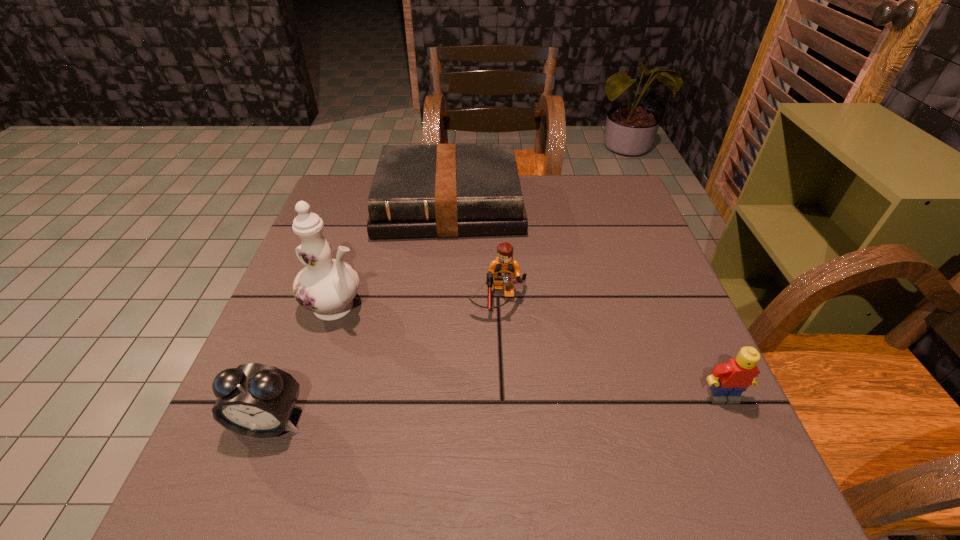
At what (x,y) coordinates should I click in order to perform the action: click on vacant area between the alarm clock and the chinaware. Please return your answer as a coordinate pair (x, y). This screenshot has height=540, width=960. Looking at the image, I should click on (303, 363).

Locate an element on the screen. The height and width of the screenshot is (540, 960). unoccupied position between the alarm clock and the nearer Lego is located at coordinates [495, 409].

Locate which object ranks fourth in proximity to the shortest object. Please provide its 2D coordinates. Your answer should be formatted as a tuple, i.e. [(x, y)], where the tuple contains the x and y coordinates of a point satisfying the conditions above.

[(728, 381)]

Locate an element on the screen. This screenshot has height=540, width=960. object that is the second closest to the alarm clock is located at coordinates (503, 269).